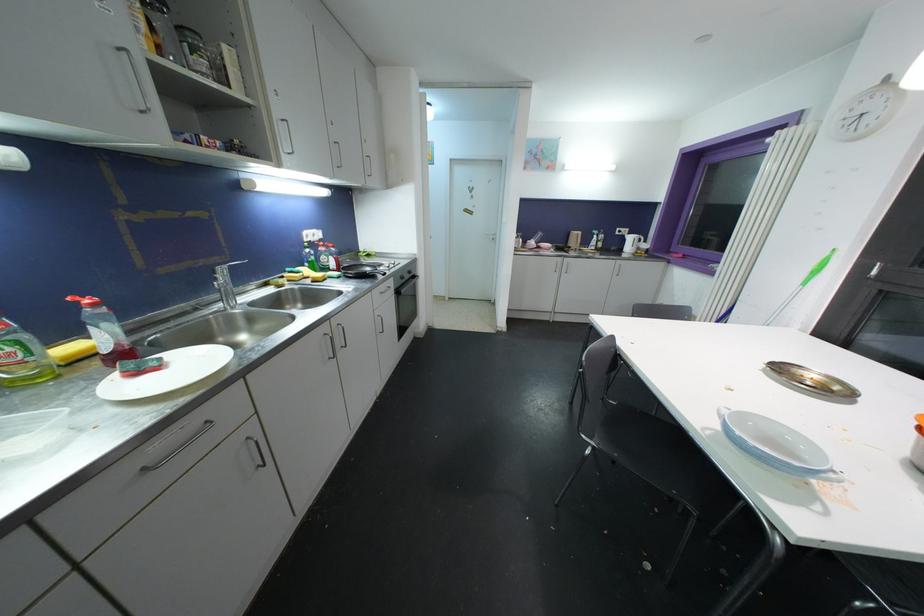
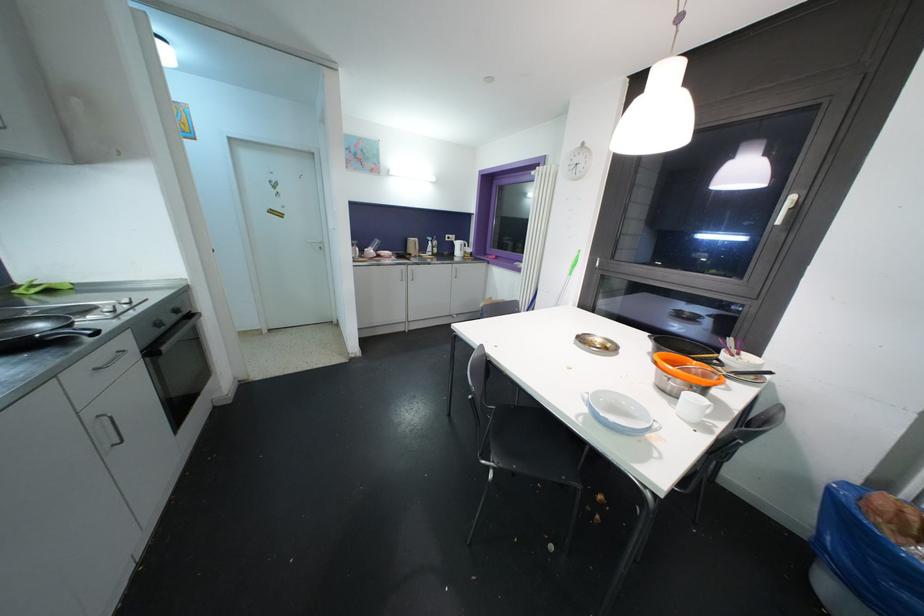
Question: Based on the continuous images, in which direction is the camera rotating? Reply with the corresponding letter.

Choices:
 (A) Left
 (B) Right
 (C) Up
 (D) Down

Answer: (B)